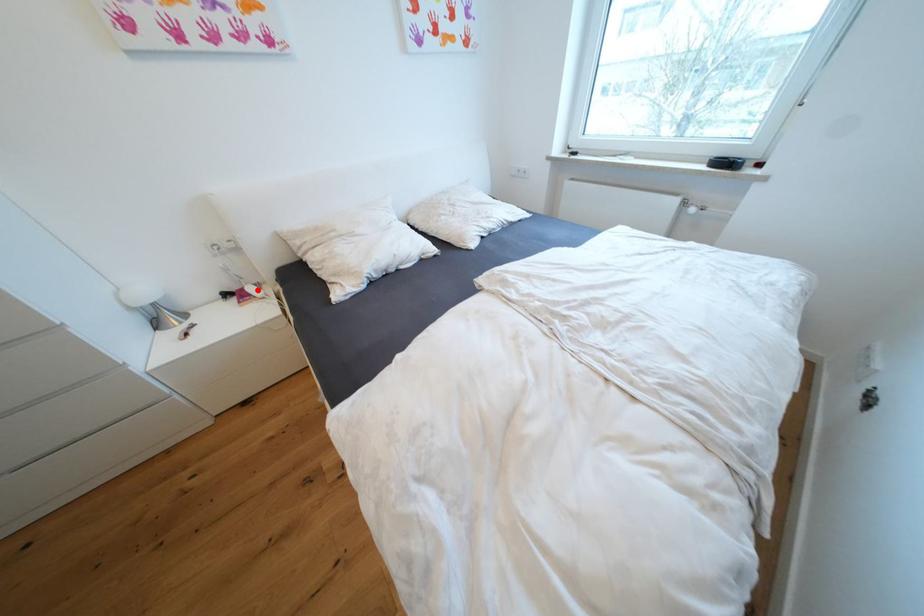
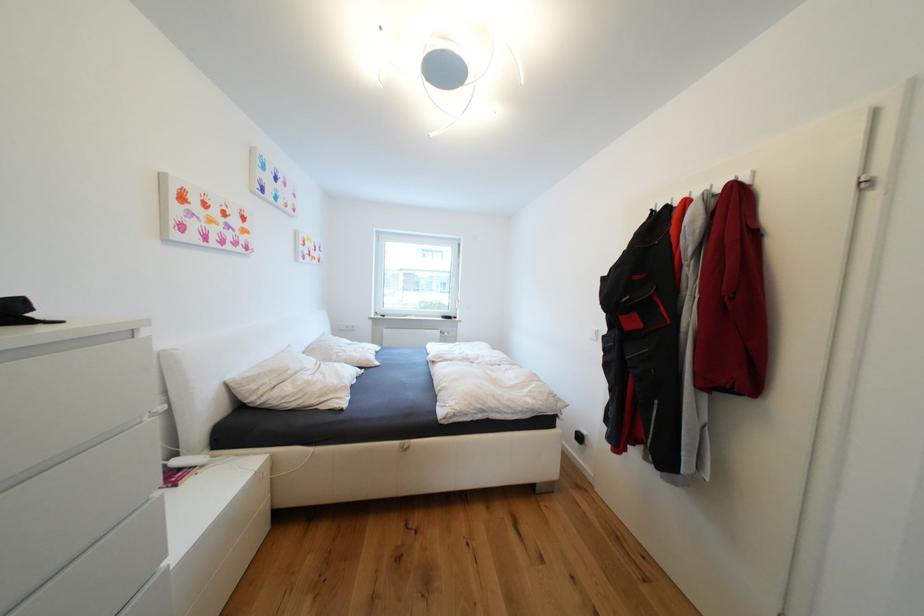
The point at the highlighted location is marked in the first image. Where is the corresponding point in the second image?

(184, 464)